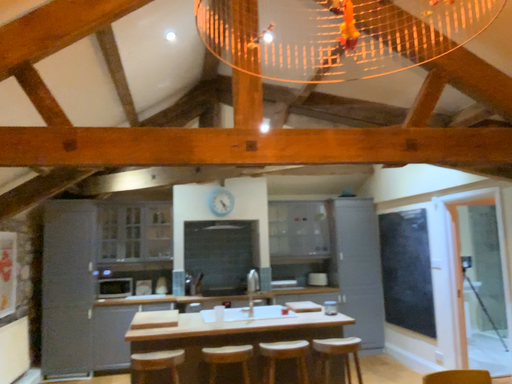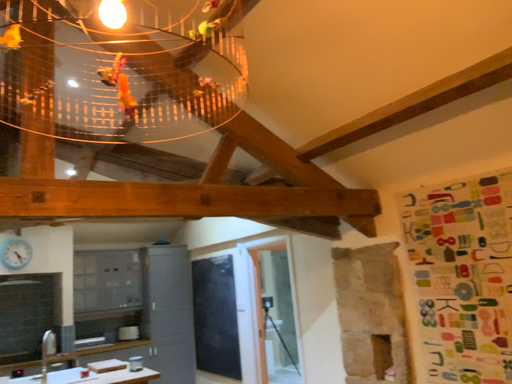
Question: How did the camera likely rotate when shooting the video?

Choices:
 (A) rotated right
 (B) rotated left

Answer: (A)